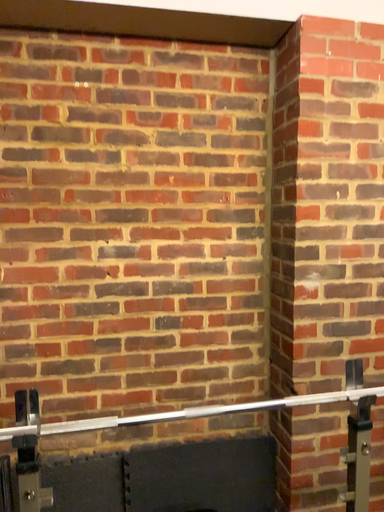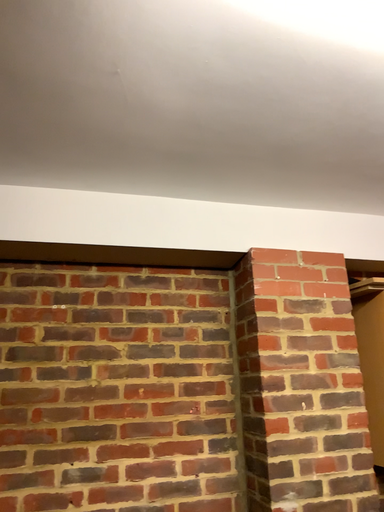
Question: How did the camera likely rotate when shooting the video?

Choices:
 (A) rotated downward
 (B) rotated upward

Answer: (B)